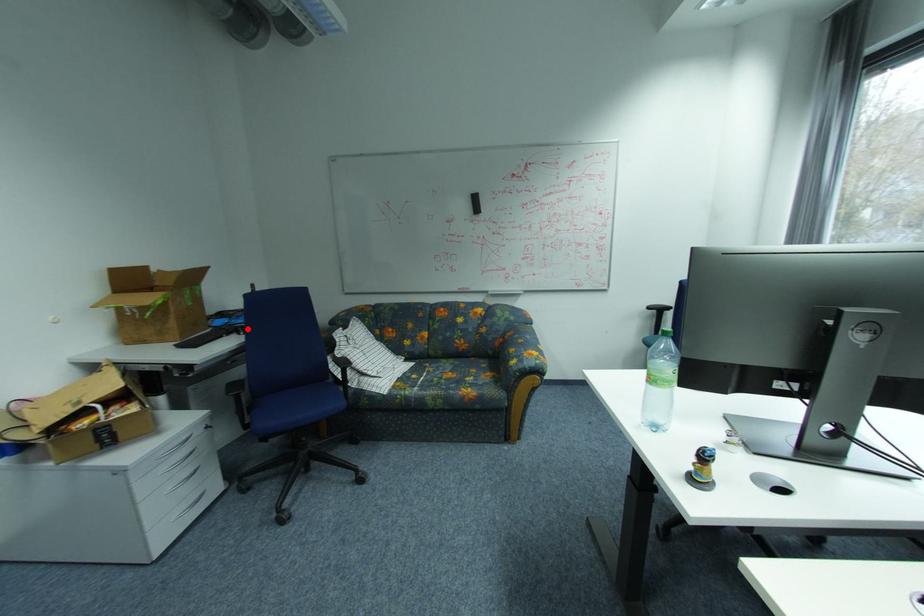
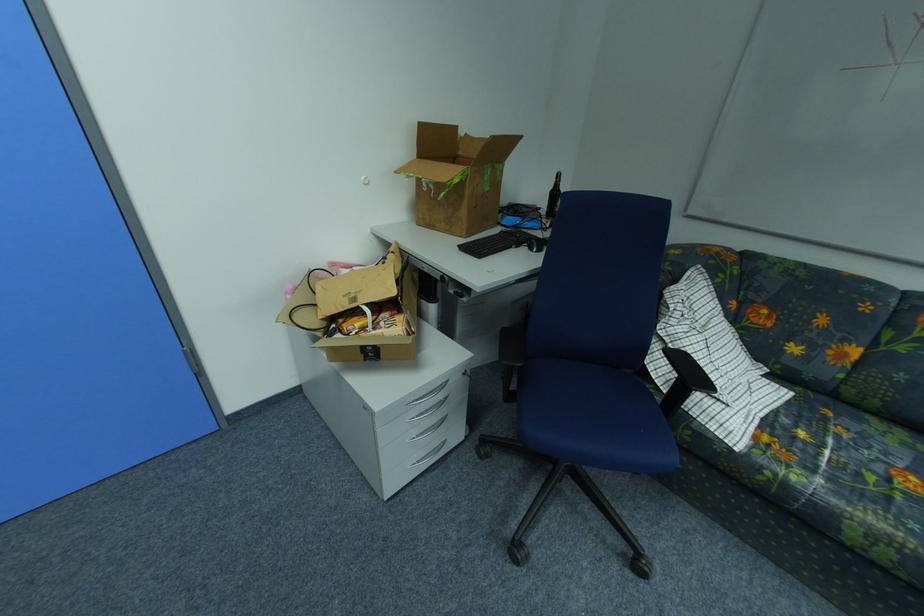
Question: I am providing you with two images of the same scene from different viewpoints. Image1 has a red point marked. In image2, the corresponding 3D location appears at what relative position? Reply with the corresponding letter.

Choices:
 (A) Closer
 (B) Farther

Answer: (A)